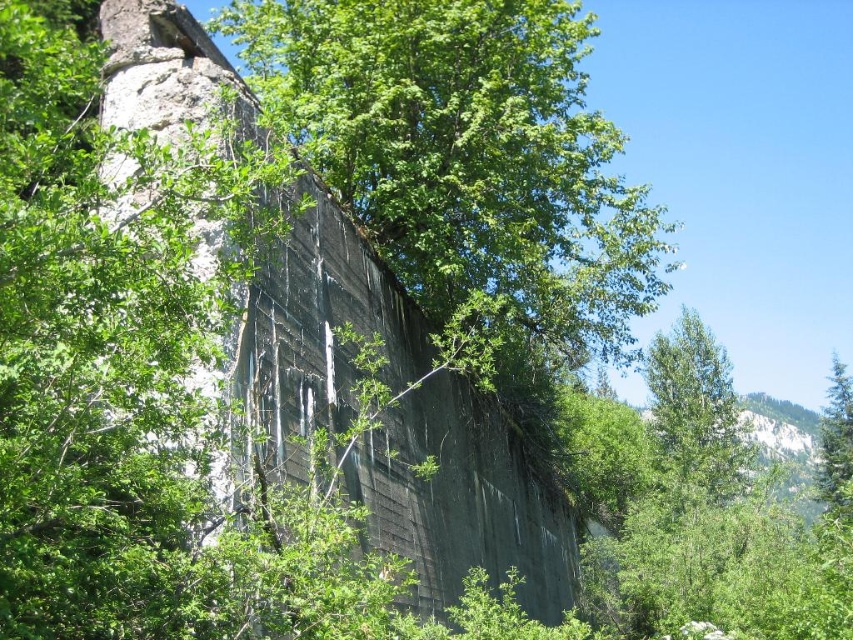
You are an environmental inspector assessing the vegetation around the aged concrete structure. You notice the green leafy tree at upper right and the green textured pine tree at right. Which tree is taller?

The green textured pine tree at right is taller than the green leafy tree at upper right.

You are standing at the base of the concrete structure and looking towards the upper right corner of the image. What do you see at point (695, 410)?

At point (695, 410) lies green leafy tree at upper right.